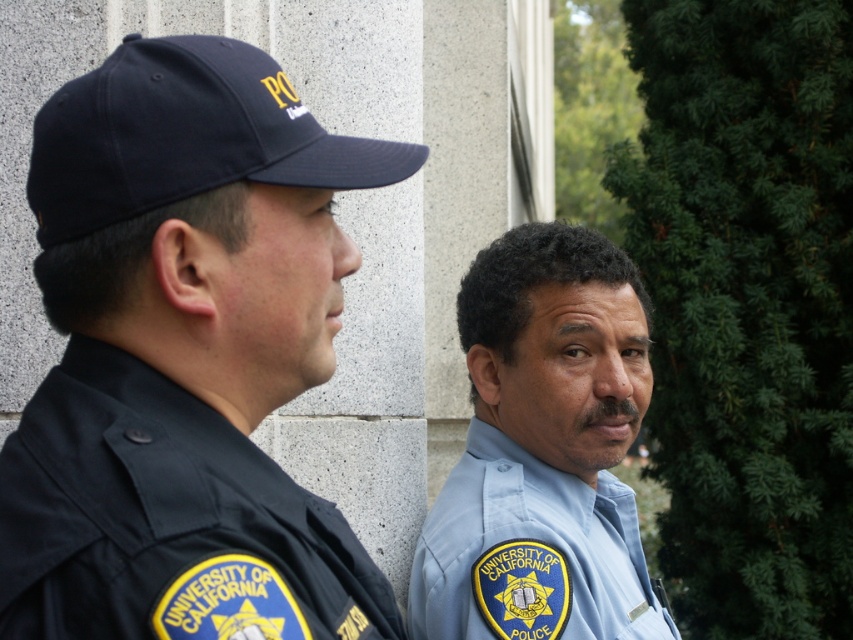
Which of these two, light blue uniform at center or navy blue fabric baseball cap at left, stands shorter?

navy blue fabric baseball cap at left

Who is more distant from viewer, [555,314] or [51,144]?

Positioned behind is point [555,314].

This screenshot has height=640, width=853. In order to click on light blue uniform at center in this screenshot , I will do `click(543, 451)`.

Between point (357, 632) and point (567, 380), which one is positioned behind?

Point (567, 380)

The height and width of the screenshot is (640, 853). I want to click on black fabric uniform at left, so click(x=165, y=520).

Is point (74, 554) less distant than point (589, 593)?

Yes, it is in front of point (589, 593).

Where is `black fabric uniform at left`? The height and width of the screenshot is (640, 853). black fabric uniform at left is located at coordinates (165, 520).

Is black fabric uniform at left below navy blue fabric baseball cap at left?

Indeed, black fabric uniform at left is positioned under navy blue fabric baseball cap at left.

Is point (170, 522) farther from viewer compared to point (250, 77)?

That is False.

Is point (173, 412) more distant than point (73, 157)?

Yes.

Where is `black fabric uniform at left`? The image size is (853, 640). black fabric uniform at left is located at coordinates (165, 520).